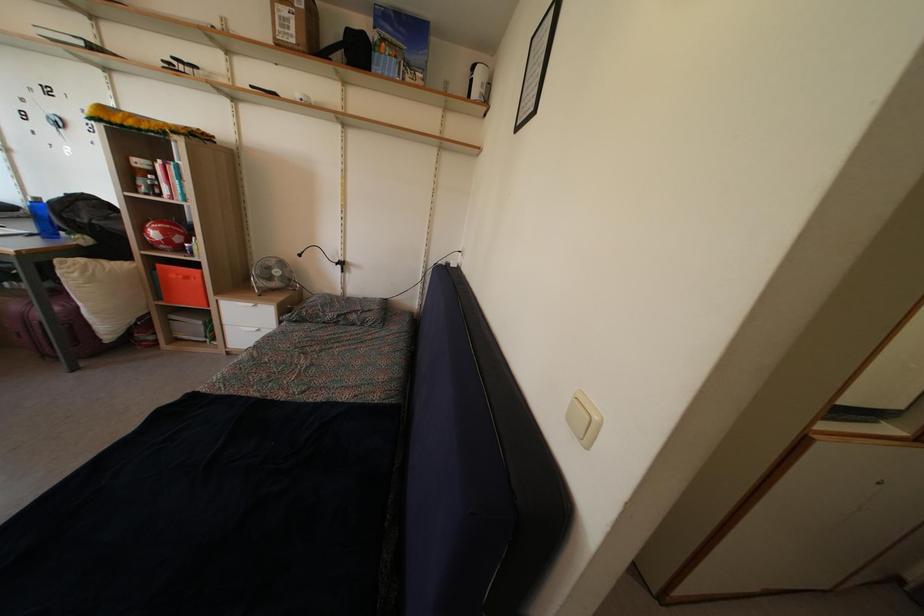
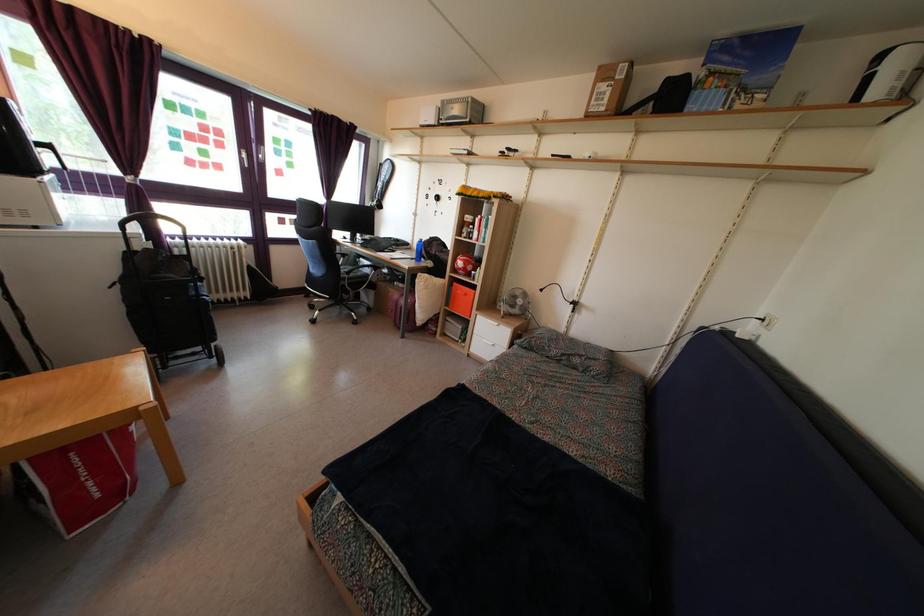
Locate, in the second image, the point that corresponds to pixel 141 171 in the first image.

(470, 227)